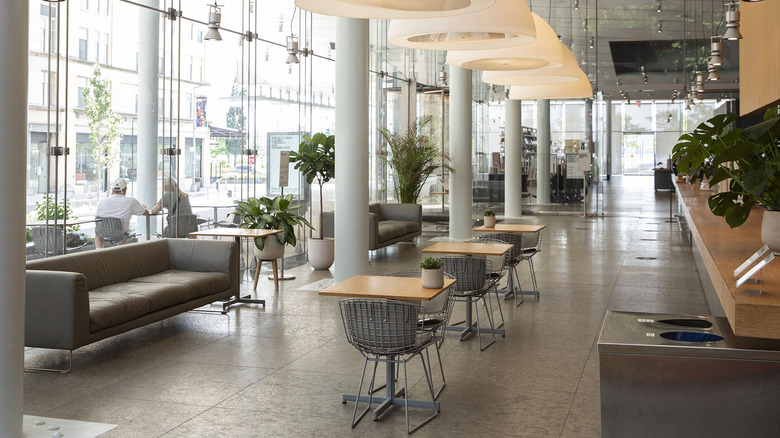
Where is `small silver hanging lights`? small silver hanging lights is located at coordinates (732, 29), (713, 55), (713, 71), (697, 82), (692, 95), (688, 106).